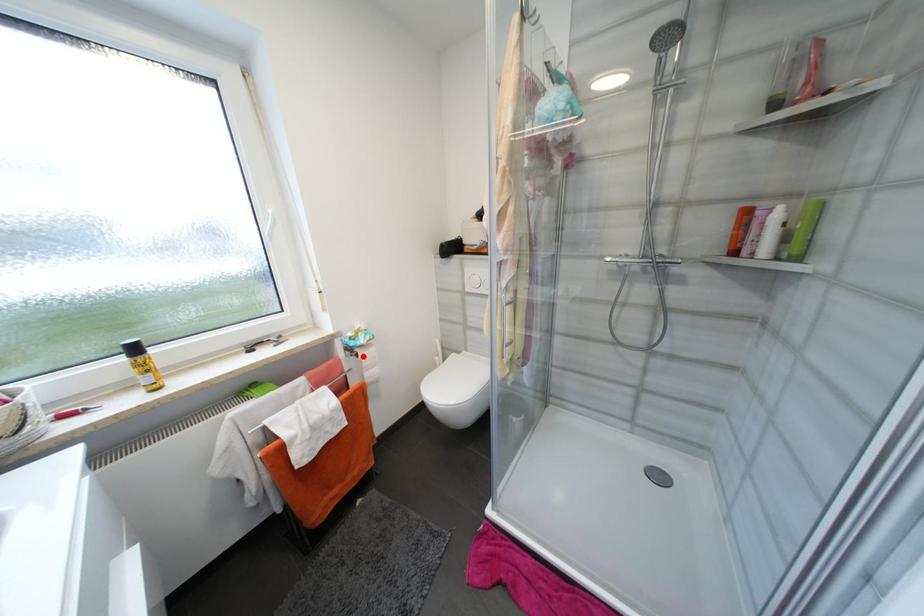
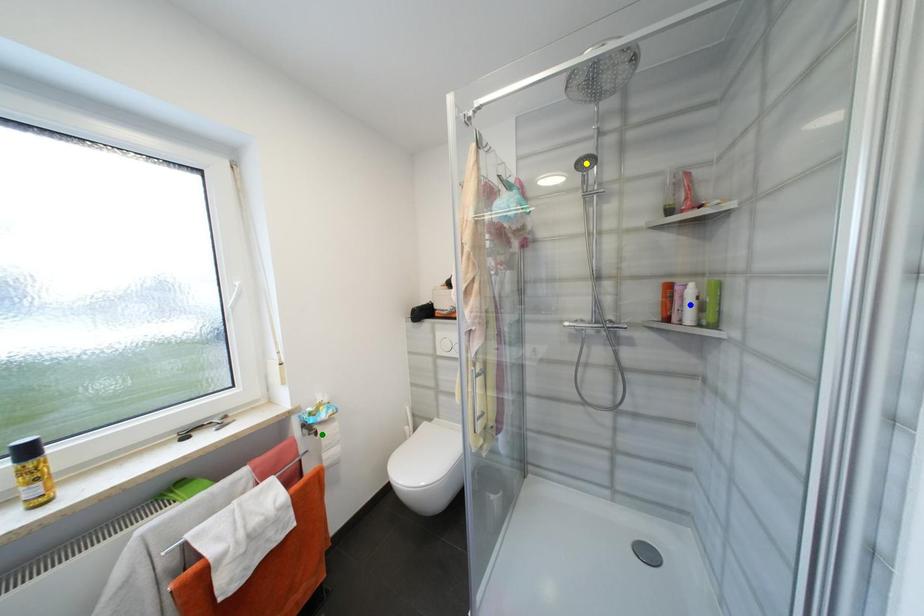
Question: I am providing you with two images of the same scene from different viewpoints. A red point is marked on the first image. You are given multiple points on the second image. Which mark in image 2 goes with the point in image 1?

Choices:
 (A) blue point
 (B) yellow point
 (C) green point

Answer: (C)